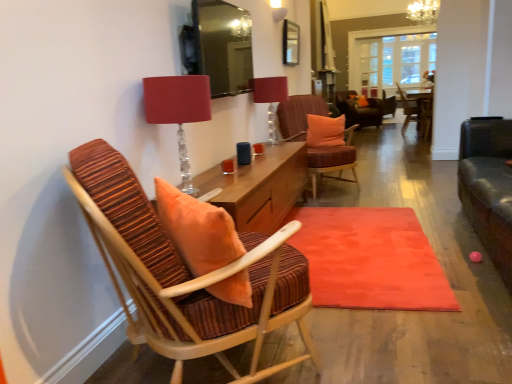
In order to click on velvet orange chair at center, arranged as the third chair when viewed from the left in this screenshot , I will do `click(360, 110)`.

Is matte glass table lamp at upper center, which appears as the 2th table lamp when ordered from the bottom, at the left side of velvet orange chair at center, arranged as the third chair when viewed from the left?

Indeed, matte glass table lamp at upper center, which appears as the 2th table lamp when ordered from the bottom, is positioned on the left side of velvet orange chair at center, arranged as the third chair when viewed from the left.

Is matte glass table lamp at upper center, arranged as the first table lamp when viewed from the top, completely or partially outside of velvet orange chair at center, which is the third chair in right-to-left order?

Yes.

Which object is closer to the camera, matte glass table lamp at upper center, the 2th table lamp positioned from the front, or velvet orange chair at center, the first chair when ordered from back to front?

matte glass table lamp at upper center, the 2th table lamp positioned from the front, is more forward.

Could you tell me if matte glass table lamp at upper center, the 2th table lamp positioned from the front, is turned towards velvet orange chair at center, arranged as the third chair when viewed from the left?

No, matte glass table lamp at upper center, the 2th table lamp positioned from the front, is not turned towards velvet orange chair at center, arranged as the third chair when viewed from the left.

From the image's perspective, is striped fabric chair at center, the fourth chair viewed from the back, on top of matte orange rug at center?

Yes.

From a real-world perspective, who is located higher, striped fabric chair at center, the second chair viewed from the left, or matte orange rug at center?

From a 3D spatial view, striped fabric chair at center, the second chair viewed from the left, is above.

From a real-world perspective, is wooden chair with striped cushion at center, arranged as the fourth chair when viewed from the front, positioned above or below orange fabric pillow at center, positioned as the first pillow in front-to-back order?

In terms of real-world spatial position, wooden chair with striped cushion at center, arranged as the fourth chair when viewed from the front, is below orange fabric pillow at center, positioned as the first pillow in front-to-back order.

Is wooden chair with striped cushion at center, which is the 4th chair in left-to-right order, shorter than orange fabric pillow at center, arranged as the second pillow when viewed from the right?

In fact, wooden chair with striped cushion at center, which is the 4th chair in left-to-right order, may be taller than orange fabric pillow at center, arranged as the second pillow when viewed from the right.

From the picture: Would you consider wooden chair with striped cushion at center, which is the 4th chair in left-to-right order, to be distant from orange fabric pillow at center, the second pillow from the top?

wooden chair with striped cushion at center, which is the 4th chair in left-to-right order, is positioned a significant distance from orange fabric pillow at center, the second pillow from the top.

Considering the positions of points (412, 115) and (307, 134), is point (412, 115) farther from camera compared to point (307, 134)?

Yes, it is behind point (307, 134).

Consider the image. Are velvet orange chair at center, the first chair when ordered from back to front, and matte orange rug at center far apart?

That's right, there is a large distance between velvet orange chair at center, the first chair when ordered from back to front, and matte orange rug at center.

Does velvet orange chair at center, positioned as the fifth chair in front-to-back order, have a smaller size compared to matte orange rug at center?

No, velvet orange chair at center, positioned as the fifth chair in front-to-back order, is not smaller than matte orange rug at center.

Image resolution: width=512 pixels, height=384 pixels. I want to click on chair that is the 5th one when counting upward from the matte orange rug at center (from the image's perspective), so click(360, 110).

From a real-world perspective, which is physically above, velvet orange chair at center, arranged as the third chair when viewed from the left, or matte orange rug at center?

velvet orange chair at center, arranged as the third chair when viewed from the left, is physically above.

Would you say clear glass door at center is outside matte orange rug at center?

Yes, clear glass door at center is outside of matte orange rug at center.

Is point (364, 62) positioned behind point (310, 237)?

Yes, it is behind point (310, 237).

Can you confirm if clear glass door at center is positioned to the right of matte orange rug at center?

Indeed, clear glass door at center is positioned on the right side of matte orange rug at center.

Is matte orange rug at center at the back of clear glass door at center?

No.

Is clear glass door at center looking in the opposite direction of striped fabric chair at center, positioned as the 4th chair in right-to-left order?

No.

Does clear glass door at center have a larger size compared to striped fabric chair at center, which is counted as the 2th chair, starting from the front?

Indeed, clear glass door at center has a larger size compared to striped fabric chair at center, which is counted as the 2th chair, starting from the front.

Are clear glass door at center and striped fabric chair at center, the fourth chair viewed from the back, located far from each other?

That's right, there is a large distance between clear glass door at center and striped fabric chair at center, the fourth chair viewed from the back.

This screenshot has width=512, height=384. Find the location of `glass door above the striped fabric chair at center, the fourth chair viewed from the back (from a real-world perspective)`. glass door above the striped fabric chair at center, the fourth chair viewed from the back (from a real-world perspective) is located at coordinates (389, 61).

Would you consider clear glass door at center to be distant from velvet orange chair at center, positioned as the fifth chair in front-to-back order?

Indeed, clear glass door at center is not near velvet orange chair at center, positioned as the fifth chair in front-to-back order.

Is clear glass door at center at the left side of velvet orange chair at center, the first chair when ordered from back to front?

No, clear glass door at center is not to the left of velvet orange chair at center, the first chair when ordered from back to front.

From a real-world perspective, between clear glass door at center and velvet orange chair at center, positioned as the fifth chair in front-to-back order, who is vertically lower?

In real-world perspective, velvet orange chair at center, positioned as the fifth chair in front-to-back order, is lower.

Do you think clear glass door at center is within velvet orange chair at center, the first chair when ordered from back to front, or outside of it?

clear glass door at center is not enclosed by velvet orange chair at center, the first chair when ordered from back to front.

Where is `table lamp that is the 1st object located below the velvet orange chair at center, positioned as the fifth chair in front-to-back order (from the image's perspective)`? Image resolution: width=512 pixels, height=384 pixels. table lamp that is the 1st object located below the velvet orange chair at center, positioned as the fifth chair in front-to-back order (from the image's perspective) is located at coordinates (270, 98).

Find the location of a particular element. the 1st chair behind when counting from the matte orange rug at center is located at coordinates click(x=332, y=160).

Considering their positions, is wooden chair with striped upholstery at center, the 5th chair viewed from the left, positioned closer to striped fabric chair at center, positioned as the 4th chair in right-to-left order, than matte orange rug at center?

matte orange rug at center.

Considering their positions, is matte red lampshade at upper center, which ranks as the second table lamp in back-to-front order, positioned closer to matte orange rug at center than wooden chair with striped upholstery at center, acting as the 1th chair starting from the right?

Among the two, matte red lampshade at upper center, which ranks as the second table lamp in back-to-front order, is located nearer to matte orange rug at center.

When comparing their distances from matte orange rug at center, does matte glass table lamp at upper center, arranged as the first table lamp when viewed from the top, or velvet orange chair at center, which is the third chair in right-to-left order, seem further?

velvet orange chair at center, which is the third chair in right-to-left order.

Based on their spatial positions, is matte glass table lamp at upper center, arranged as the first table lamp when viewed from the top, or matte red lampshade at upper center, the 2th table lamp positioned from the right, closer to orange fabric pillow at center, placed as the first pillow when sorted from bottom to top?

matte glass table lamp at upper center, arranged as the first table lamp when viewed from the top, is positioned closer to the anchor orange fabric pillow at center, placed as the first pillow when sorted from bottom to top.

Estimate the real-world distances between objects in this image. Which object is further from matte glass table lamp at upper center, which appears as the 2th table lamp when ordered from the bottom, matte orange rug at center or clear glass door at center?

Among the two, clear glass door at center is located further to matte glass table lamp at upper center, which appears as the 2th table lamp when ordered from the bottom.

Considering their positions, is matte orange rug at center positioned closer to orange fabric pillow at center, which is counted as the second pillow, starting from the front, than velvet orange chair at center, which is the third chair in right-to-left order?

velvet orange chair at center, which is the third chair in right-to-left order, is positioned closer to the anchor orange fabric pillow at center, which is counted as the second pillow, starting from the front.

Considering their positions, is matte red lampshade at upper center, which appears as the 1th table lamp when viewed from the left, positioned closer to clear glass door at center than orange fabric pillow at center, positioned as the first pillow in front-to-back order?

Among the two, orange fabric pillow at center, positioned as the first pillow in front-to-back order, is located nearer to clear glass door at center.

Which object lies further to the anchor point wooden chair with striped upholstery at center, which appears as the 3th chair when viewed from the front, orange fabric pillow at center, positioned as the first pillow in front-to-back order, or orange fabric pillow at center, placed as the first pillow when sorted from back to front?

The object further to wooden chair with striped upholstery at center, which appears as the 3th chair when viewed from the front, is orange fabric pillow at center, positioned as the first pillow in front-to-back order.

The width and height of the screenshot is (512, 384). I want to click on pillow between striped fabric chair at left, the first chair from the front, and velvet orange chair at center, which is the third chair in right-to-left order, in the front-back direction, so click(325, 131).

Where is `glass door positioned between matte glass table lamp at upper center, positioned as the second table lamp in left-to-right order, and orange fabric pillow at center, which is the second pillow from left to right, from near to far`? glass door positioned between matte glass table lamp at upper center, positioned as the second table lamp in left-to-right order, and orange fabric pillow at center, which is the second pillow from left to right, from near to far is located at coordinates (389, 61).

This screenshot has height=384, width=512. I want to click on chair between matte glass table lamp at upper center, the 2th table lamp positioned from the front, and orange fabric pillow at center, placed as the first pillow when sorted from bottom to top, in the front-back direction, so click(x=332, y=160).

This screenshot has height=384, width=512. I want to click on pillow between striped fabric chair at left, the first chair from the front, and orange fabric pillow at center, which is the 1th pillow in right-to-left order, along the z-axis, so click(325, 131).